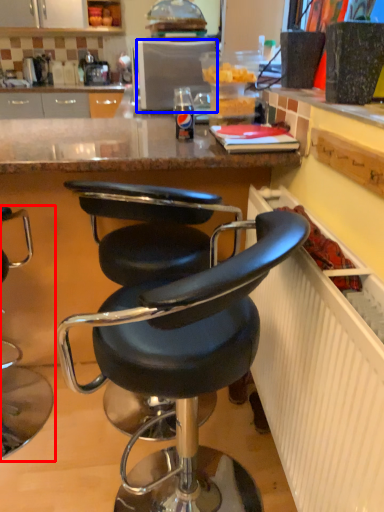
Question: Which of the following is the farthest to the observer, chair (highlighted by a red box) or appliance (highlighted by a blue box)?

Choices:
 (A) chair
 (B) appliance

Answer: (B)